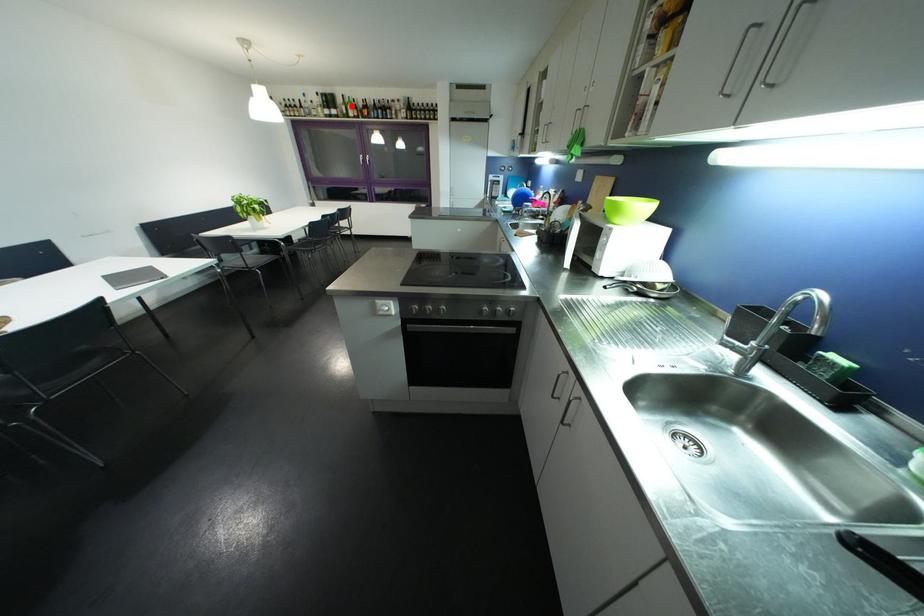
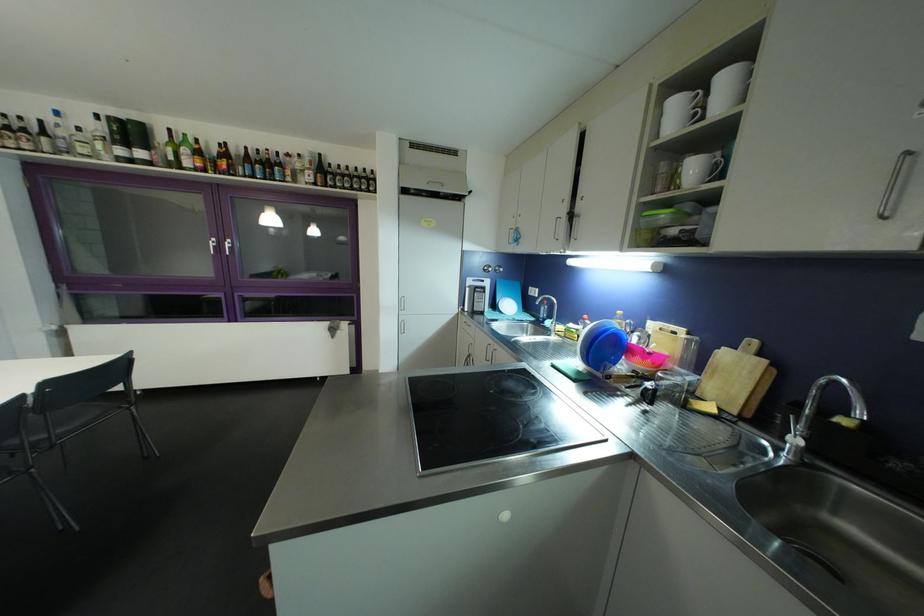
Question: A red point is marked in image1. In image2, is the corresponding 3D point closer to the camera or farther? Reply with the corresponding letter.

Choices:
 (A) The corresponding 3D point is closer.
 (B) The corresponding 3D point is farther.

Answer: (B)